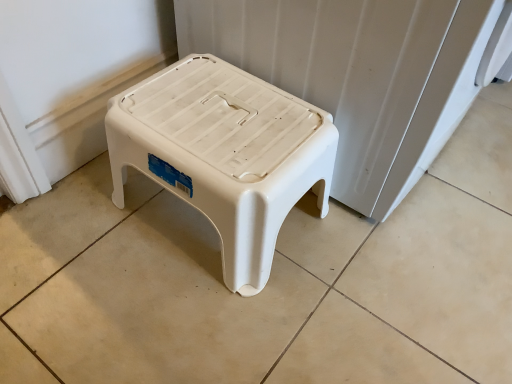
Where is `free spot to the right of white plastic stool at center`? The image size is (512, 384). free spot to the right of white plastic stool at center is located at coordinates (375, 267).